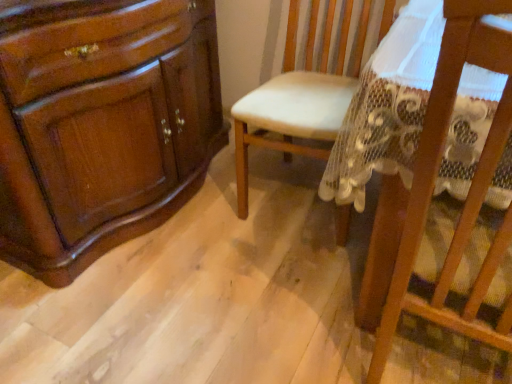
Find the location of a particular element. This screenshot has height=384, width=512. vacant space underneath white leather chair at center, the 1th chair positioned from the back (from a real-world perspective) is located at coordinates (294, 197).